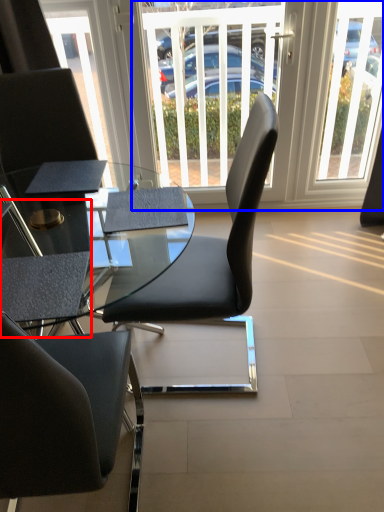
Question: Which point is closer to the camera, armchair (highlighted by a red box) or window screen (highlighted by a blue box)?

Choices:
 (A) armchair
 (B) window screen

Answer: (A)